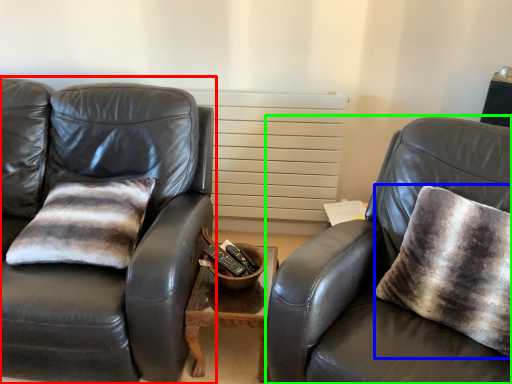
Question: Which object is positioned farthest from studio couch (highlighted by a red box)? Select from throw pillow (highlighted by a blue box) and chair (highlighted by a green box).

Choices:
 (A) throw pillow
 (B) chair

Answer: (A)